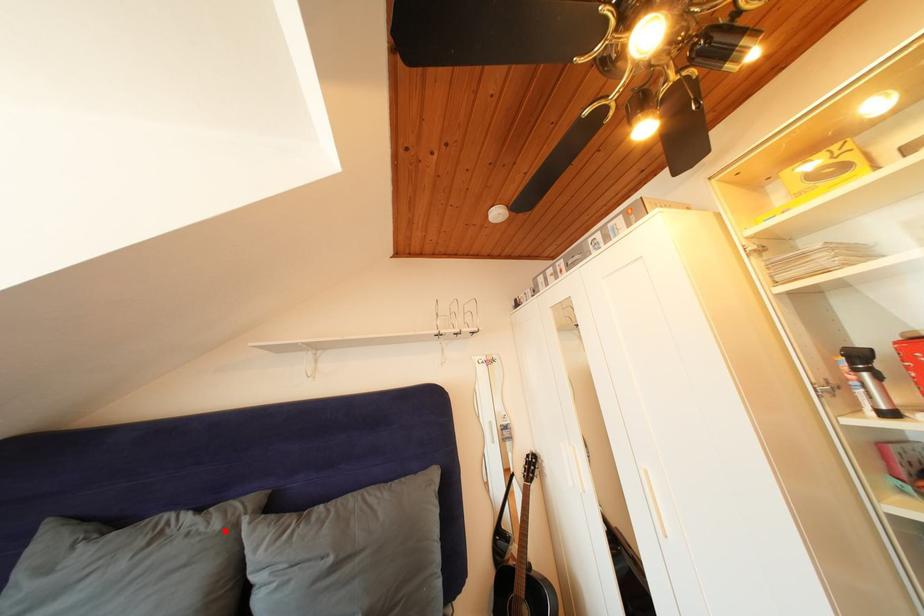
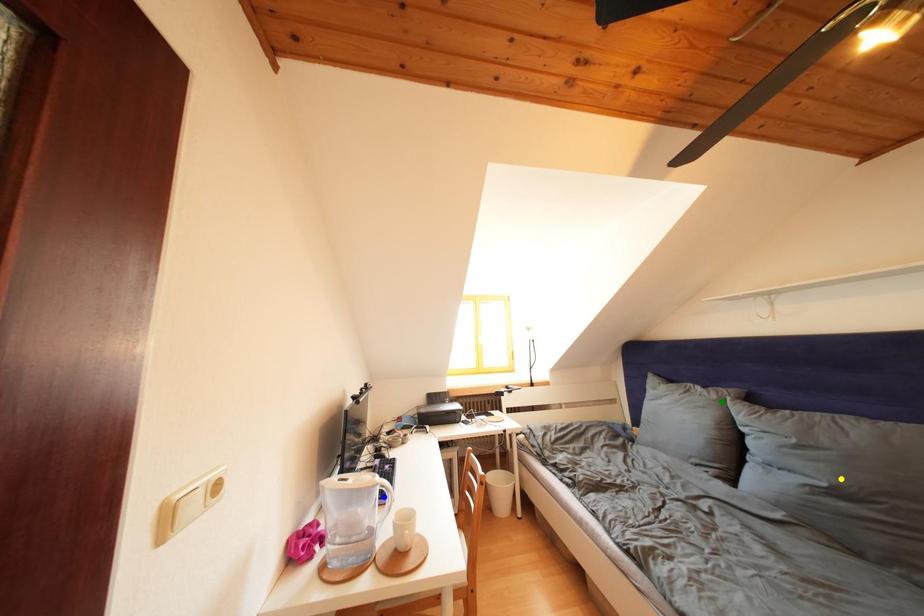
Question: I am providing you with two images of the same scene from different viewpoints. A red point is marked on the first image. You are given multiple points on the second image. Which point in image 2 represents the same 3d spot as the red point in image 1?

Choices:
 (A) blue point
 (B) green point
 (C) yellow point

Answer: (B)